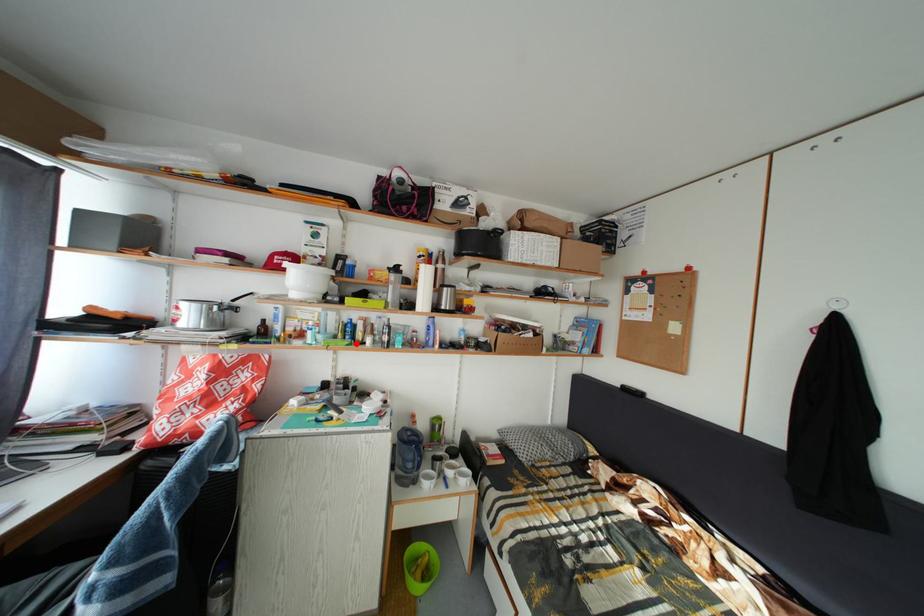
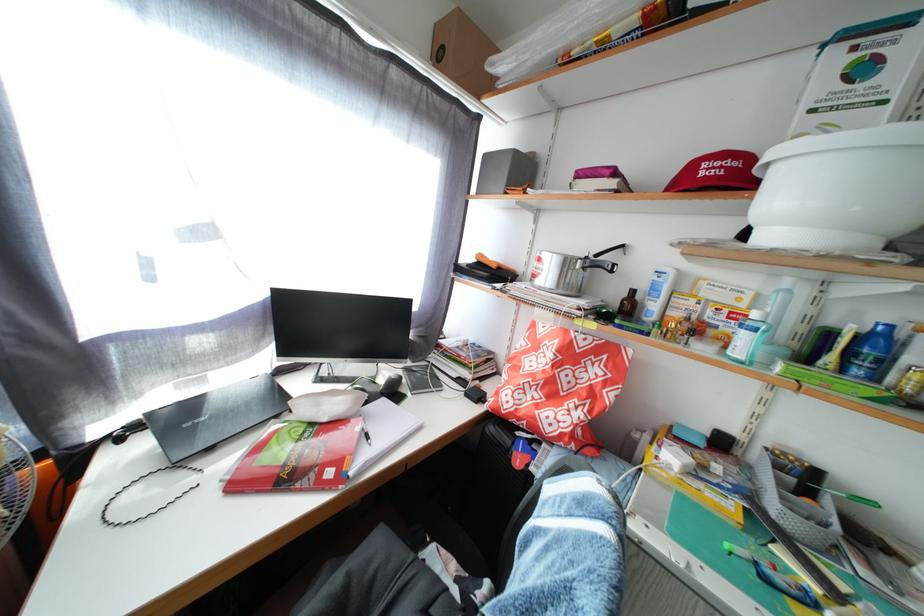
Question: I am providing you with two images of the same scene from different viewpoints. A red point is marked on the first image. At the location where the point appears in image 1, is it still visible in image 2?

Choices:
 (A) Yes
 (B) No

Answer: (A)